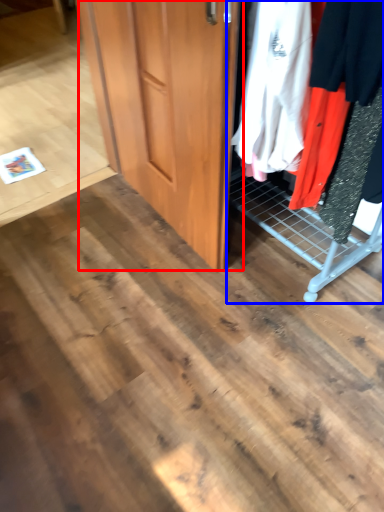
Question: Which of the following is the closest to the observer, door (highlighted by a red box) or closet (highlighted by a blue box)?

Choices:
 (A) door
 (B) closet

Answer: (B)